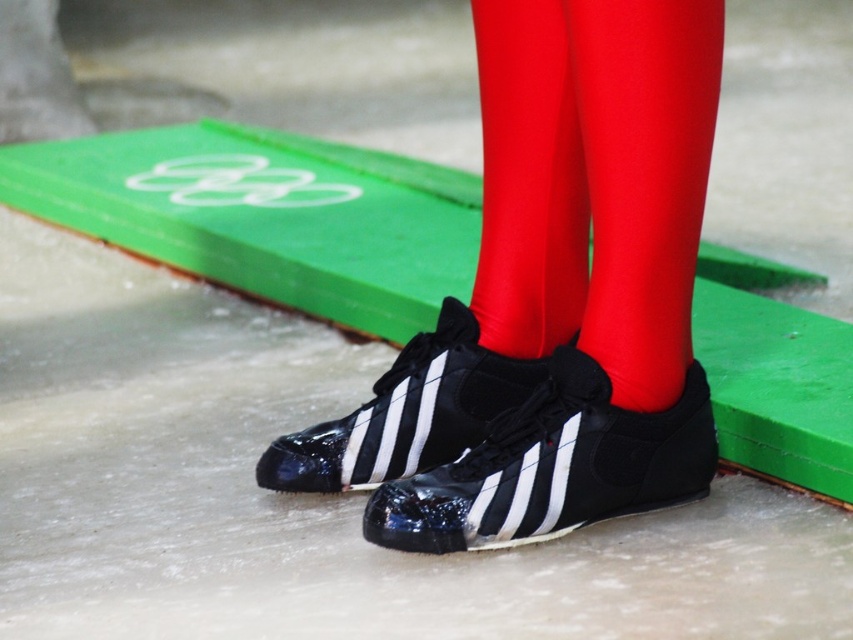
You are an athlete preparing for a competition and notice the matte black sock at center and the black rubber shoe at center. Which item is positioned higher on your leg?

The matte black sock at center is located above the black rubber shoe at center, so it is positioned higher on your leg.

You are a photographer standing at the camera position. You want to place a small sticker exactly 5 feet away from the camera towards the direction of the point at coordinates point (595, 497). Will the sticker land on the green rectangular mat with Olympic rings?

The distance between the point (595, 497) and the camera is 6.06 feet. Since you want to place the sticker 5 feet away from the camera in that direction, the sticker will be 1.06 feet before reaching the point (595, 497). Therefore, the sticker will land on the green rectangular mat with Olympic rings.

You are an athlete preparing for a competition and need to choose between the shiny red tights at center and the matte black sock at center. Based on their positions in the image, which one is located to the right of the other?

The shiny red tights at center is positioned on the right side of matte black sock at center, so the shiny red tights at center is located to the right of the matte black sock at center.